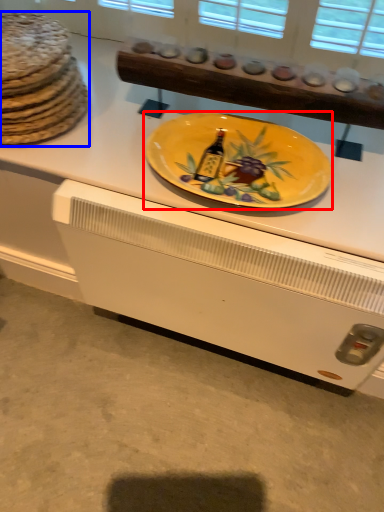
Question: Which of the following is the closest to the observer, plate (highlighted by a red box) or chocolate cake (highlighted by a blue box)?

Choices:
 (A) plate
 (B) chocolate cake

Answer: (A)